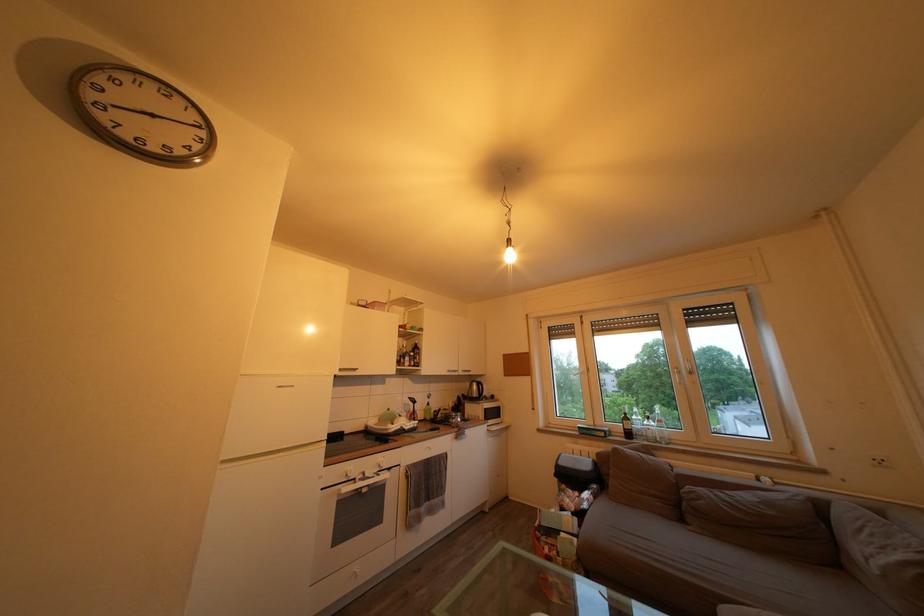
The width and height of the screenshot is (924, 616). In order to click on white window handle in this screenshot , I will do `click(688, 366)`.